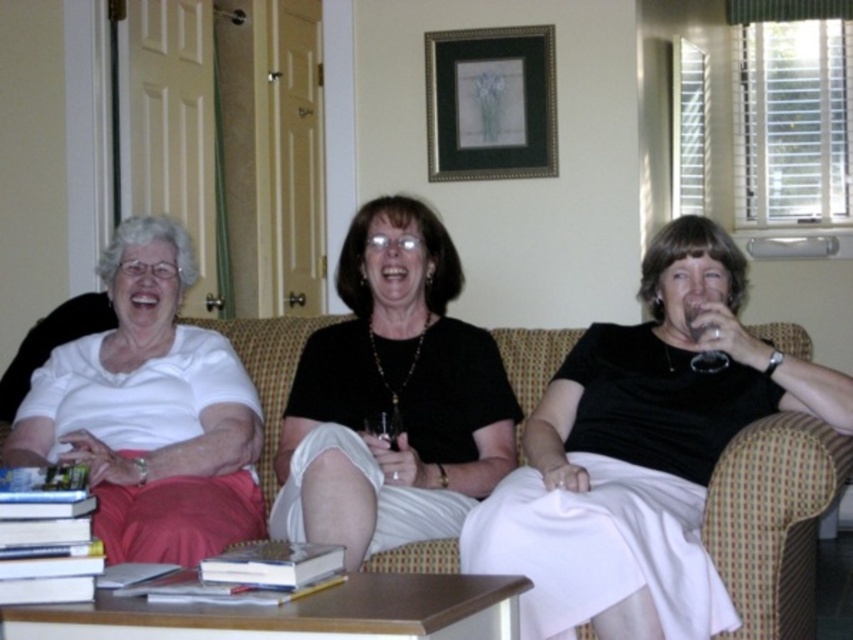
You are a photographer setting up for a group photo in a living room. You see the black matte dress at center and the plush beige couch at center. Which object is positioned higher from the floor?

The black matte dress at center is above the plush beige couch at center, so it is positioned higher from the floor.

You are standing in the living room and want to place a small plant between the two points, point (x=45, y=417) and point (x=242, y=353). Which point should the plant be closer to in order to be positioned in front of the other point?

The plant should be closer to point (x=45, y=417) because it is in front of point (x=242, y=353).

You are standing in the living room and want to know the distance to a specific point marked as point (x=786, y=588). Can you estimate how far it is from where you are standing?

The point (x=786, y=588) is 2.28 meters away from the viewer.